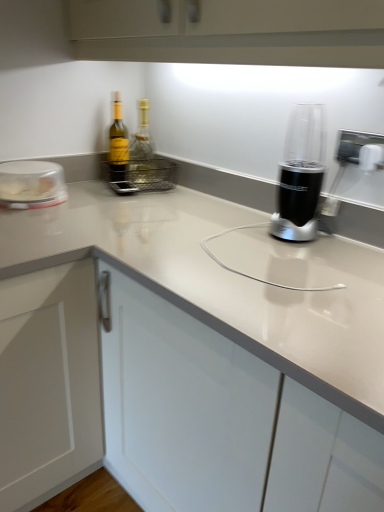
Question: From the image's perspective, is green glass bottle at upper left, acting as the 1th bottle starting from the left, on clear plastic container at left?

Choices:
 (A) no
 (B) yes

Answer: (B)

Question: Is green glass bottle at upper left, acting as the 1th bottle starting from the left, wider than clear plastic container at left?

Choices:
 (A) yes
 (B) no

Answer: (B)

Question: From a real-world perspective, is green glass bottle at upper left, acting as the 1th bottle starting from the left, positioned under clear plastic container at left based on gravity?

Choices:
 (A) yes
 (B) no

Answer: (B)

Question: Is green glass bottle at upper left, acting as the 1th bottle starting from the left, smaller than clear plastic container at left?

Choices:
 (A) yes
 (B) no

Answer: (A)

Question: Is the position of green glass bottle at upper left, acting as the 1th bottle starting from the left, more distant than that of clear plastic container at left?

Choices:
 (A) yes
 (B) no

Answer: (A)

Question: Is white glossy countertop at center in front of or behind black plastic blender at center in the image?

Choices:
 (A) behind
 (B) front

Answer: (B)

Question: From a real-world perspective, is white glossy countertop at center physically located above or below black plastic blender at center?

Choices:
 (A) above
 (B) below

Answer: (B)

Question: In terms of height, does white glossy countertop at center look taller or shorter compared to black plastic blender at center?

Choices:
 (A) short
 (B) tall

Answer: (B)

Question: Is white glossy countertop at center to the left or to the right of black plastic blender at center in the image?

Choices:
 (A) right
 (B) left

Answer: (B)

Question: In terms of width, does clear plastic container at left look wider or thinner when compared to white glossy countertop at center?

Choices:
 (A) wide
 (B) thin

Answer: (B)

Question: Considering the positions of clear plastic container at left and white glossy countertop at center in the image, is clear plastic container at left taller or shorter than white glossy countertop at center?

Choices:
 (A) short
 (B) tall

Answer: (A)

Question: In the image, is clear plastic container at left positioned in front of or behind white glossy countertop at center?

Choices:
 (A) behind
 (B) front

Answer: (A)

Question: From a real-world perspective, is clear plastic container at left positioned above or below white glossy countertop at center?

Choices:
 (A) above
 (B) below

Answer: (A)

Question: Is translucent glass bottle at center, which appears as the 2th bottle when viewed from the left, in front of or behind white glossy countertop at center in the image?

Choices:
 (A) front
 (B) behind

Answer: (B)

Question: From a real-world perspective, is translucent glass bottle at center, which appears as the 2th bottle when viewed from the left, above or below white glossy countertop at center?

Choices:
 (A) below
 (B) above

Answer: (B)